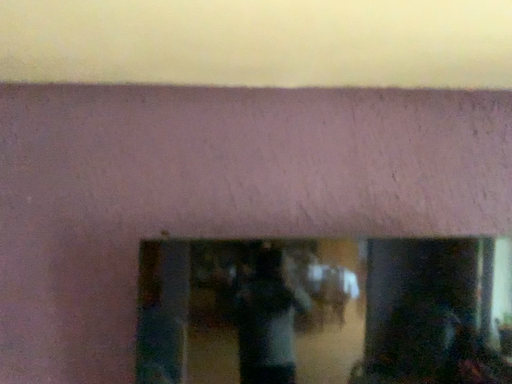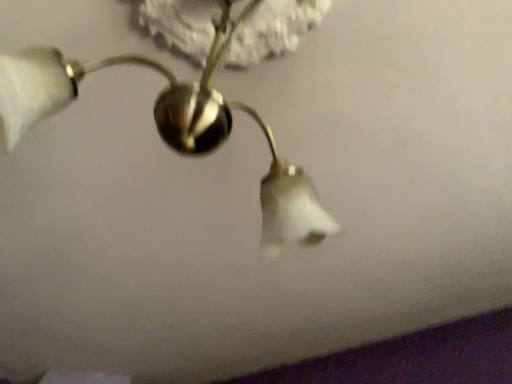
Question: Which way did the camera rotate in the video?

Choices:
 (A) rotated left
 (B) rotated right

Answer: (A)